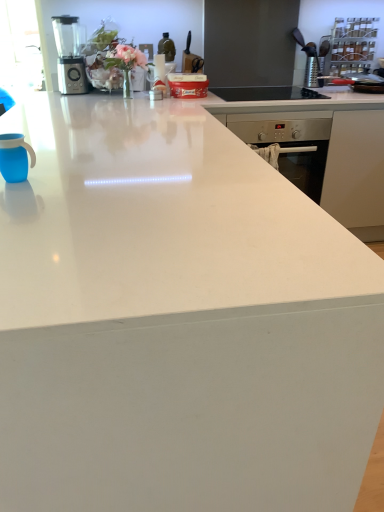
Where is `free space to the back side of blue matte mug at left`? The height and width of the screenshot is (512, 384). free space to the back side of blue matte mug at left is located at coordinates (55, 154).